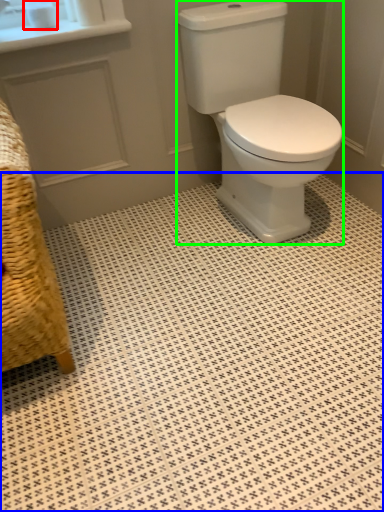
Question: Which object is positioned farthest from toilet paper (highlighted by a red box)? Select from ceramic tile (highlighted by a blue box) and porcelain (highlighted by a green box).

Choices:
 (A) ceramic tile
 (B) porcelain

Answer: (A)